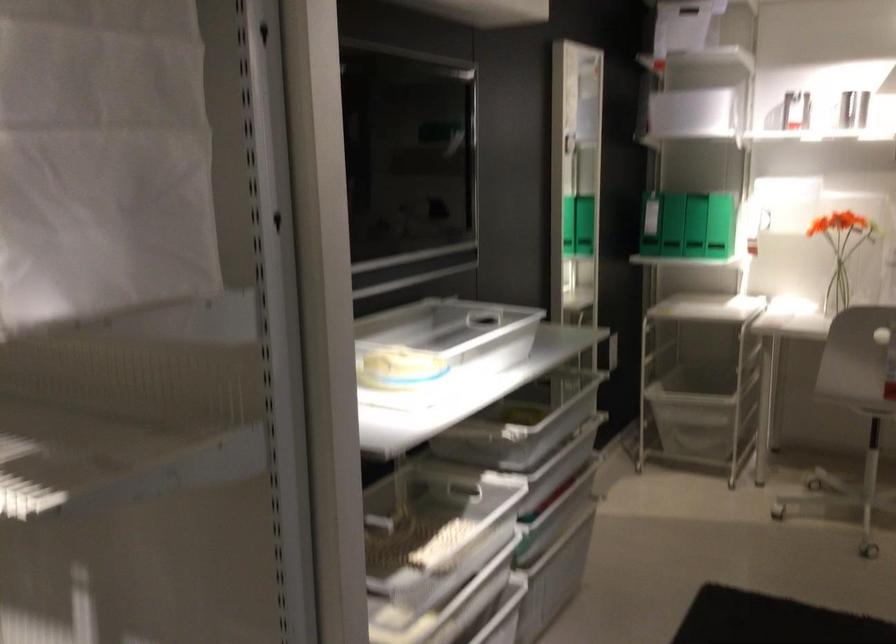
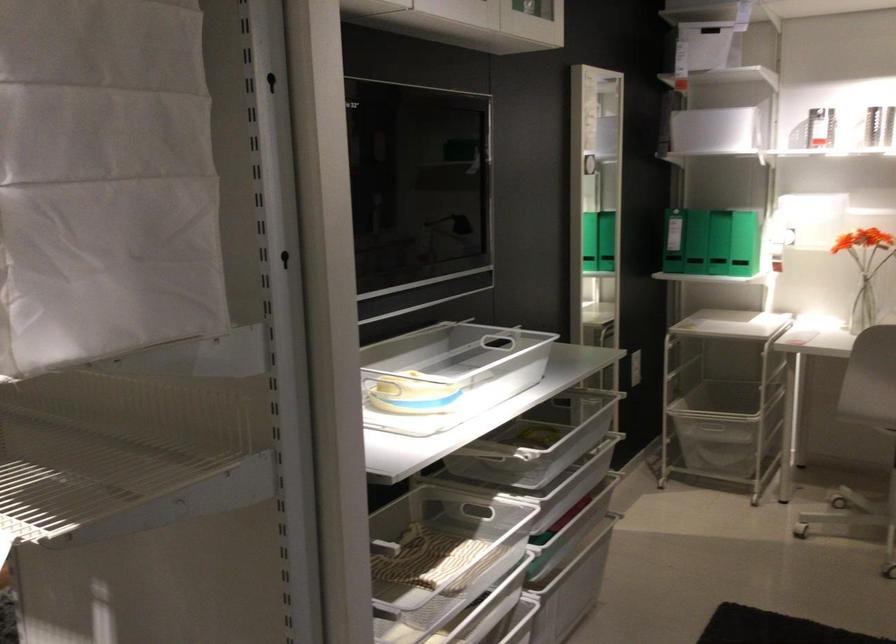
Find the pixel in the second image that matches point 731,221 in the first image.

(745, 243)